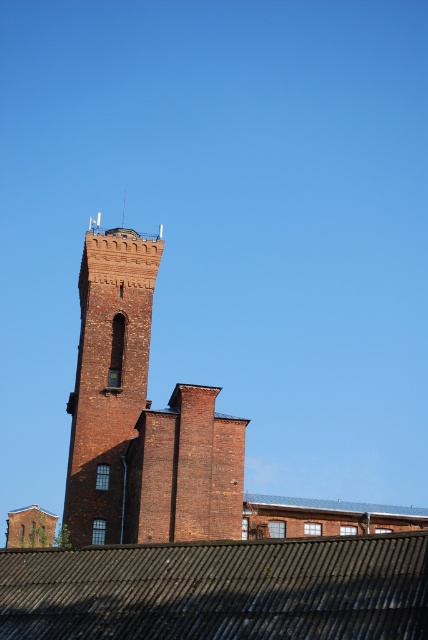
You are a maintenance worker assessing the building. You need to determine which structure is taller between the rusty corrugated metal roof at lower center and the brick tower at upper left. Based on the scene, which one is taller?

The brick tower at upper left is taller than the rusty corrugated metal roof at lower center.